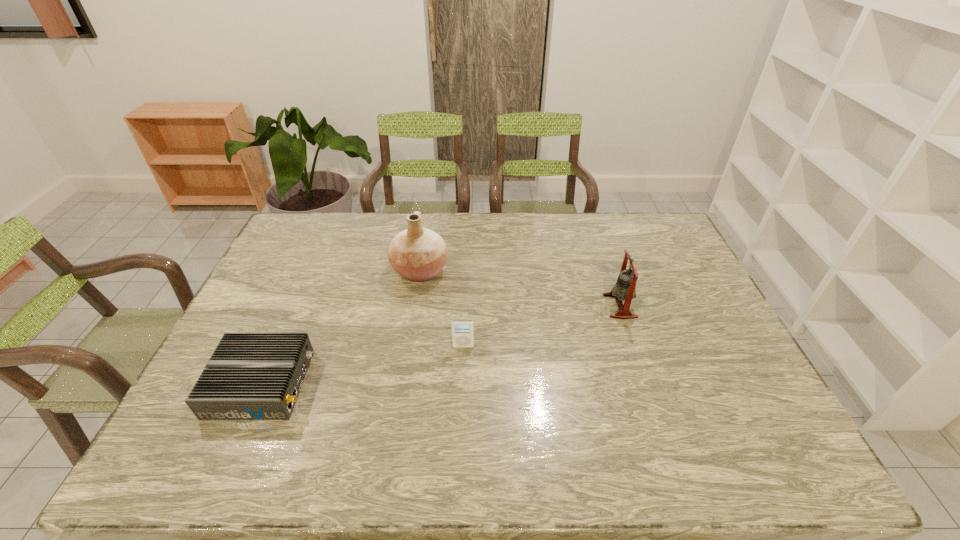
At what (x,y) coordinates should I click in order to perform the action: click on free space located on the front-facing side of the third object from left to right. Please return your answer as a coordinate pair (x, y). Looking at the image, I should click on (460, 456).

Where is `blank area located 0.170m on the back panel of the nearest object`? blank area located 0.170m on the back panel of the nearest object is located at coordinates (376, 383).

You are a GUI agent. You are given a task and a screenshot of the screen. Output one action in this format:
    pyautogui.click(x=<x>, y=<y>)
    Task: Click on the object situated at the left edge
    The height and width of the screenshot is (540, 960).
    Given the screenshot: What is the action you would take?
    pyautogui.click(x=250, y=376)

This screenshot has height=540, width=960. In order to click on vacant space at the far edge of the desktop in this screenshot , I will do `click(373, 215)`.

Identify the location of free location at the near edge. (527, 469).

You are a GUI agent. You are given a task and a screenshot of the screen. Output one action in this format:
    pyautogui.click(x=<x>, y=<y>)
    Task: Click on the vacant region at the left edge of the desktop
    
    Given the screenshot: What is the action you would take?
    pyautogui.click(x=267, y=278)

Locate an element on the screen. vacant space at the right edge is located at coordinates pyautogui.click(x=726, y=326).

Image resolution: width=960 pixels, height=540 pixels. In order to click on free space at the far left corner in this screenshot , I will do (334, 221).

This screenshot has height=540, width=960. What are the coordinates of `free space between the third object from right to left and the iPod` in the screenshot? It's located at (442, 308).

I want to click on vacant space that's between the third object from right to left and the router, so click(341, 327).